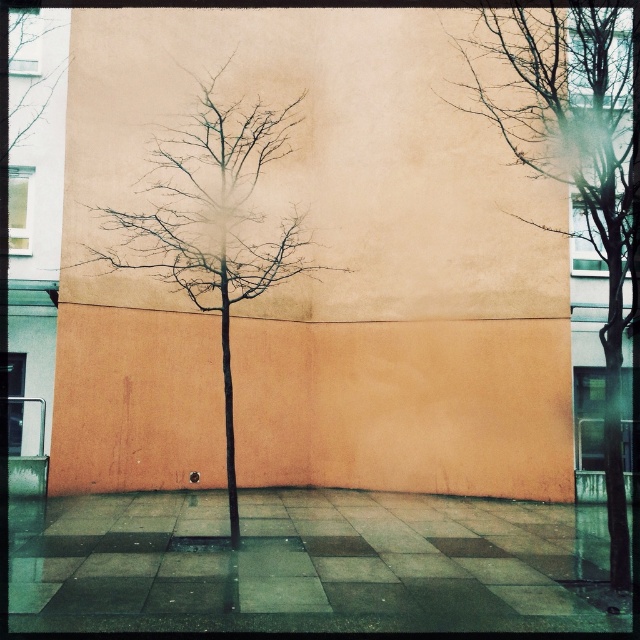
Question: Does brown bark tree at center have a larger size compared to bare branches at upper left?

Choices:
 (A) no
 (B) yes

Answer: (B)

Question: Is bare branches at center bigger than brown bark tree at center?

Choices:
 (A) no
 (B) yes

Answer: (A)

Question: Which of the following is the closest to the observer?

Choices:
 (A) (612, 44)
 (B) (186, 156)

Answer: (A)

Question: Does bare branches at center appear on the left side of brown bark tree at center?

Choices:
 (A) no
 (B) yes

Answer: (A)

Question: Which of the following is the closest to the observer?

Choices:
 (A) bare branches at center
 (B) bare branches at upper left

Answer: (A)

Question: Estimate the real-world distances between objects in this image. Which object is closer to the bare branches at center?

Choices:
 (A) bare branches at upper left
 (B) brown bark tree at center

Answer: (B)